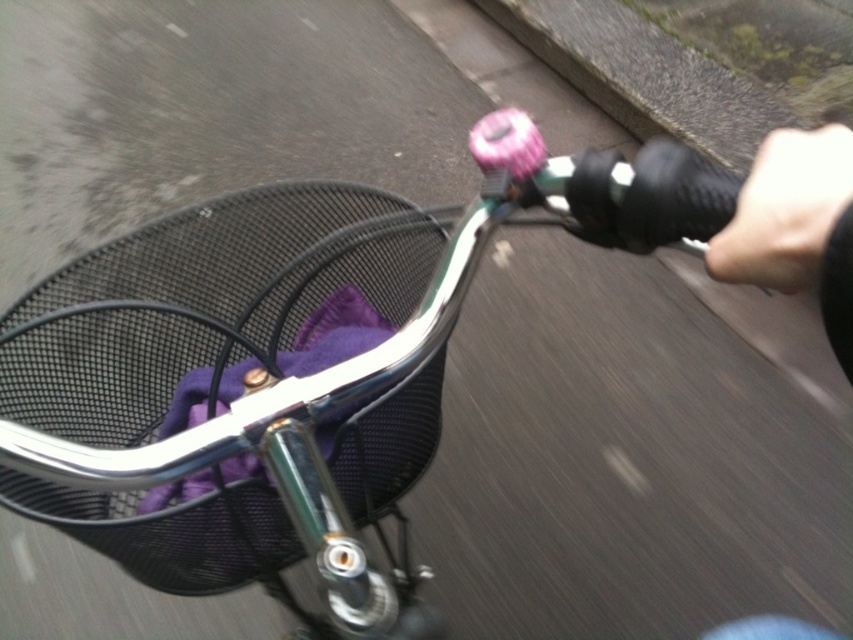
Can you confirm if black mesh basket at lower left is smaller than black leather handlebar grip at right?

Actually, black mesh basket at lower left might be larger than black leather handlebar grip at right.

Which of these two, black mesh basket at lower left or black leather handlebar grip at right, stands shorter?

With less height is black leather handlebar grip at right.

Locate an element on the screen. This screenshot has width=853, height=640. black mesh basket at lower left is located at coordinates (202, 300).